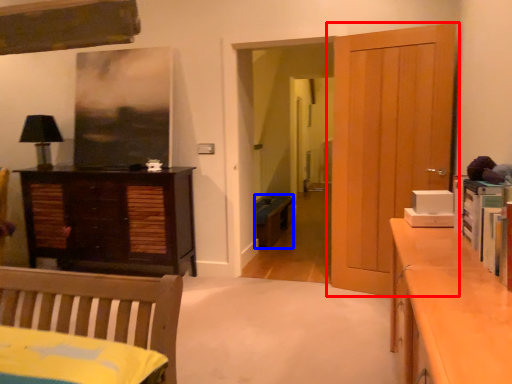
Question: Which point is further to the camera, door (highlighted by a red box) or cabinetry (highlighted by a blue box)?

Choices:
 (A) door
 (B) cabinetry

Answer: (B)